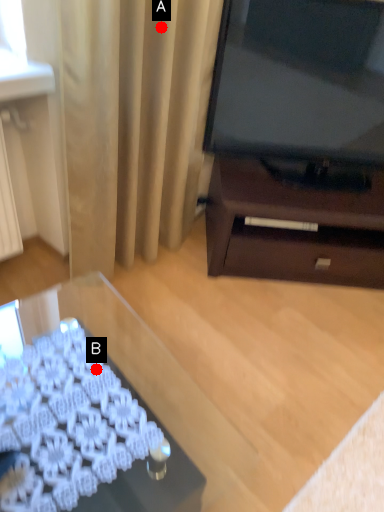
Question: Two points are circled on the image, labeled by A and B beside each circle. Which point is closer to the camera?

Choices:
 (A) A is closer
 (B) B is closer

Answer: (B)